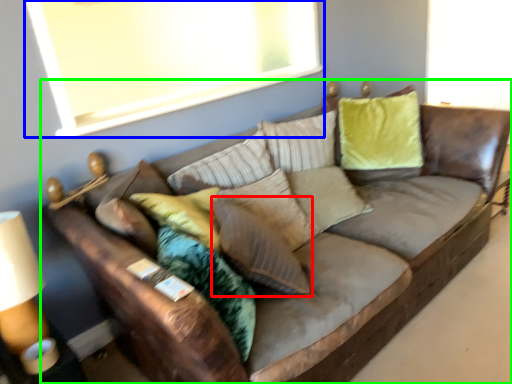
Question: Which object is the farthest from pillow (highlighted by a red box)? Choose among these: window screen (highlighted by a blue box) or studio couch (highlighted by a green box).

Choices:
 (A) window screen
 (B) studio couch

Answer: (A)